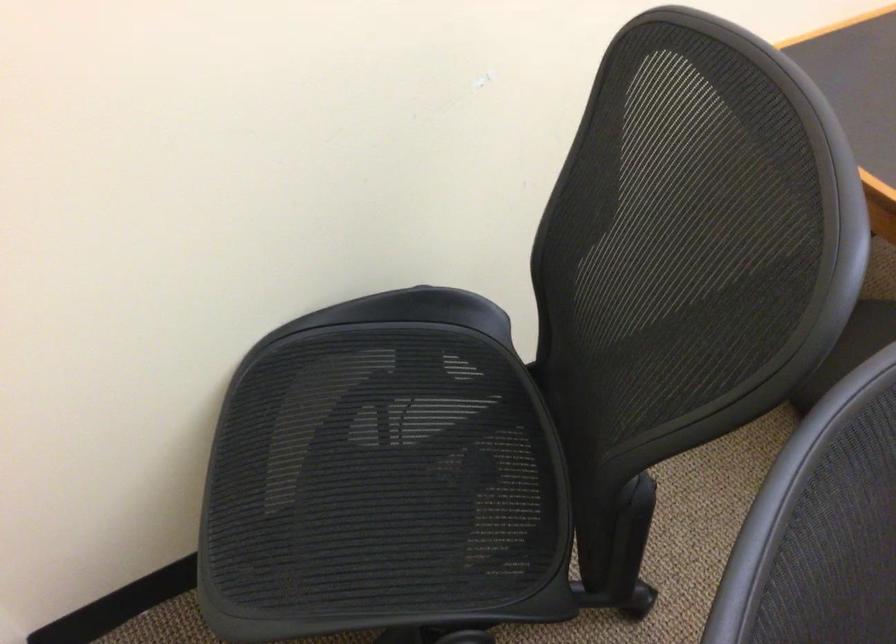
What do you see at coordinates (380, 478) in the screenshot? I see `the chair sitting surface` at bounding box center [380, 478].